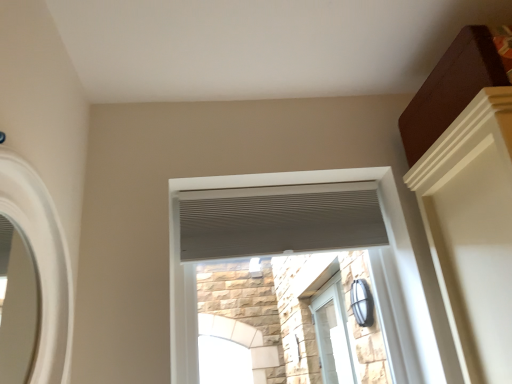
The height and width of the screenshot is (384, 512). What do you see at coordinates (385, 226) in the screenshot?
I see `white textured vent at center, acting as the 2th window starting from the right` at bounding box center [385, 226].

Image resolution: width=512 pixels, height=384 pixels. What do you see at coordinates (41, 262) in the screenshot? I see `white matte mirror at left, the third window viewed from the right` at bounding box center [41, 262].

You are a GUI agent. You are given a task and a screenshot of the screen. Output one action in this format:
    pyautogui.click(x=<x>, y=<y>)
    Task: Click on the white textured vent at center, which is the second window in bottom-to-top order
    
    Given the screenshot: What is the action you would take?
    pyautogui.click(x=385, y=226)

Locate an element on the screen. Image resolution: width=512 pixels, height=384 pixels. the 1st window positioned below the white matte mirror at left, which is the 3th window from bottom to top (from the image's perspective) is located at coordinates (385, 226).

Consider the image. Can you tell me how much white matte mirror at left, which appears as the first window when viewed from the top, and white textured vent at center, marked as the 2th window in a top-to-bottom arrangement, differ in facing direction?

→ The facing directions of white matte mirror at left, which appears as the first window when viewed from the top, and white textured vent at center, marked as the 2th window in a top-to-bottom arrangement, are 89.9 degrees apart.

Can white textured vent at center, acting as the 2th window starting from the right, be found inside white matte mirror at left, which is the 3th window from bottom to top?

Definitely not — white textured vent at center, acting as the 2th window starting from the right, is not inside white matte mirror at left, which is the 3th window from bottom to top.

Which object is closer to the camera, white matte mirror at left, marked as the 3th window in a back-to-front arrangement, or white textured vent at center, which appears as the second window when viewed from the back?

white matte mirror at left, marked as the 3th window in a back-to-front arrangement.

Is white textured blind at upper center oriented towards clear glass door at center, marked as the 3th window in a left-to-right arrangement?

No, white textured blind at upper center is not aimed at clear glass door at center, marked as the 3th window in a left-to-right arrangement.

From the image's perspective, which is below, white textured blind at upper center or clear glass door at center, which is the third window in top-to-bottom order?

clear glass door at center, which is the third window in top-to-bottom order, appears lower in the image.

Can we say white textured blind at upper center lies outside clear glass door at center, which appears as the 1th window when ordered from the bottom?

That's correct, white textured blind at upper center is outside of clear glass door at center, which appears as the 1th window when ordered from the bottom.

Is clear glass door at center, marked as the 3th window in a left-to-right arrangement, behind white textured blind at upper center?

Yes, clear glass door at center, marked as the 3th window in a left-to-right arrangement, is further from the camera.

From a real-world perspective, count 2nd windows downward from the white textured blind at upper center and point to it. Please provide its 2D coordinates.

[(332, 335)]

Is clear glass door at center, marked as the 3th window in a left-to-right arrangement, bigger than white textured blind at upper center?

Correct, clear glass door at center, marked as the 3th window in a left-to-right arrangement, is larger in size than white textured blind at upper center.

Find the location of `the 2nd window in front of the clear glass door at center, the first window from the right`. the 2nd window in front of the clear glass door at center, the first window from the right is located at coordinates (41, 262).

Is white matte mirror at left, which is the 3th window from bottom to top, taller or shorter than clear glass door at center, which is the third window in top-to-bottom order?

Considering their sizes, white matte mirror at left, which is the 3th window from bottom to top, has less height than clear glass door at center, which is the third window in top-to-bottom order.

How much distance is there between white matte mirror at left, which appears as the first window when viewed from the top, and clear glass door at center, which appears as the 1th window when ordered from the bottom?

white matte mirror at left, which appears as the first window when viewed from the top, is 2.87 meters away from clear glass door at center, which appears as the 1th window when ordered from the bottom.

In the image, is white matte mirror at left, the third window viewed from the right, on the left side or the right side of clear glass door at center, marked as the 3th window in a left-to-right arrangement?

From the image, it's evident that white matte mirror at left, the third window viewed from the right, is to the left of clear glass door at center, marked as the 3th window in a left-to-right arrangement.

From the image's perspective, is white matte mirror at left, which is the 1th window in left-to-right order, on white textured blind at upper center?

No, from the image's perspective, white matte mirror at left, which is the 1th window in left-to-right order, is not over white textured blind at upper center.

Which object is further away from the camera taking this photo, white matte mirror at left, which is the 1th window in left-to-right order, or white textured blind at upper center?

Positioned behind is white textured blind at upper center.

Is white matte mirror at left, which is the 1th window in left-to-right order, oriented away from white textured blind at upper center?

white matte mirror at left, which is the 1th window in left-to-right order, is not turned away from white textured blind at upper center.

Would you say white matte mirror at left, the third window viewed from the right, contains white textured blind at upper center?

That's incorrect, white textured blind at upper center is not inside white matte mirror at left, the third window viewed from the right.

Between white textured vent at center, which is the second window in bottom-to-top order, and white matte mirror at left, which is the 3th window from bottom to top, which one has smaller width?

white matte mirror at left, which is the 3th window from bottom to top, is thinner.

Between point (175, 353) and point (45, 306), which one is positioned behind?

Point (175, 353)

From a real-world perspective, which object stands above the other?

From a 3D spatial view, white textured vent at center, marked as the 2th window in a top-to-bottom arrangement, is above.

Is white textured vent at center, acting as the 2th window starting from the right, oriented towards white matte mirror at left, the third window viewed from the right?

Yes, white textured vent at center, acting as the 2th window starting from the right, is facing white matte mirror at left, the third window viewed from the right.

Which of these two, white textured blind at upper center or white textured vent at center, arranged as the 2th window when viewed from the front, stands shorter?

With less height is white textured blind at upper center.

Is white textured blind at upper center not within white textured vent at center, marked as the 2th window in a top-to-bottom arrangement?

white textured blind at upper center lies outside white textured vent at center, marked as the 2th window in a top-to-bottom arrangement,'s area.

Between white textured blind at upper center and white textured vent at center, marked as the 2th window in a top-to-bottom arrangement, which one has larger width?

Wider between the two is white textured vent at center, marked as the 2th window in a top-to-bottom arrangement.

From a real-world perspective, relative to white textured vent at center, which appears as the second window when viewed from the back, is white textured blind at upper center vertically above or below?

white textured blind at upper center is above white textured vent at center, which appears as the second window when viewed from the back.

From the white matte mirror at left, the third window viewed from the right, count 1st windows backward and point to it. Please provide its 2D coordinates.

[(385, 226)]

There is a clear glass door at center, which appears as the 1th window when ordered from the bottom. Where is `blind above it (from a real-world perspective)`? blind above it (from a real-world perspective) is located at coordinates click(279, 220).

Looking at the image, which one is located further to white textured blind at upper center, white matte mirror at left, acting as the first window starting from the front, or white textured vent at center, which appears as the second window when viewed from the back?

white matte mirror at left, acting as the first window starting from the front, is positioned further to the anchor white textured blind at upper center.

Looking at the image, which one is located further to white textured blind at upper center, white textured vent at center, arranged as the 2th window when viewed from the front, or white matte mirror at left, marked as the 3th window in a back-to-front arrangement?

The object further to white textured blind at upper center is white matte mirror at left, marked as the 3th window in a back-to-front arrangement.

Consider the image. When comparing their distances from white matte mirror at left, which appears as the first window when viewed from the top, does white textured blind at upper center or white textured vent at center, marked as the 2th window in a top-to-bottom arrangement, seem further?

Among the two, white textured blind at upper center is located further to white matte mirror at left, which appears as the first window when viewed from the top.

Which object lies nearer to the anchor point white textured vent at center, which appears as the second window when viewed from the back, white textured blind at upper center or white matte mirror at left, acting as the first window starting from the front?

white textured blind at upper center is closer to white textured vent at center, which appears as the second window when viewed from the back.

Considering their positions, is white textured vent at center, arranged as the 2th window when viewed from the left, positioned closer to clear glass door at center, marked as the 3th window in a left-to-right arrangement, than white matte mirror at left, marked as the 3th window in a back-to-front arrangement?

Based on the image, white textured vent at center, arranged as the 2th window when viewed from the left, appears to be nearer to clear glass door at center, marked as the 3th window in a left-to-right arrangement.

Looking at the image, which one is located closer to white textured blind at upper center, clear glass door at center, which ranks as the third window in front-to-back order, or white matte mirror at left, marked as the 3th window in a back-to-front arrangement?

white matte mirror at left, marked as the 3th window in a back-to-front arrangement, is closer to white textured blind at upper center.

Which object lies nearer to the anchor point clear glass door at center, which is the third window in top-to-bottom order, white textured blind at upper center or white textured vent at center, which appears as the second window when viewed from the back?

white textured blind at upper center is closer to clear glass door at center, which is the third window in top-to-bottom order.

Estimate the real-world distances between objects in this image. Which object is further from clear glass door at center, which is counted as the first window, starting from the back, white matte mirror at left, the third window viewed from the right, or white textured blind at upper center?

white matte mirror at left, the third window viewed from the right.

This screenshot has width=512, height=384. Identify the location of window between white matte mirror at left, acting as the first window starting from the front, and white textured blind at upper center in the front-back direction. (385, 226).

Where is `blind between white matte mirror at left, which is the 1th window in left-to-right order, and clear glass door at center, which is the third window in top-to-bottom order, in the front-back direction`? The image size is (512, 384). blind between white matte mirror at left, which is the 1th window in left-to-right order, and clear glass door at center, which is the third window in top-to-bottom order, in the front-back direction is located at coordinates (279, 220).

Where is `blind positioned between white textured vent at center, arranged as the 2th window when viewed from the left, and clear glass door at center, which is counted as the first window, starting from the back, from near to far`? Image resolution: width=512 pixels, height=384 pixels. blind positioned between white textured vent at center, arranged as the 2th window when viewed from the left, and clear glass door at center, which is counted as the first window, starting from the back, from near to far is located at coordinates (279, 220).

Locate an element on the screen. The width and height of the screenshot is (512, 384). window between white matte mirror at left, which is the 1th window in left-to-right order, and clear glass door at center, which ranks as the third window in front-to-back order, in the front-back direction is located at coordinates (385, 226).